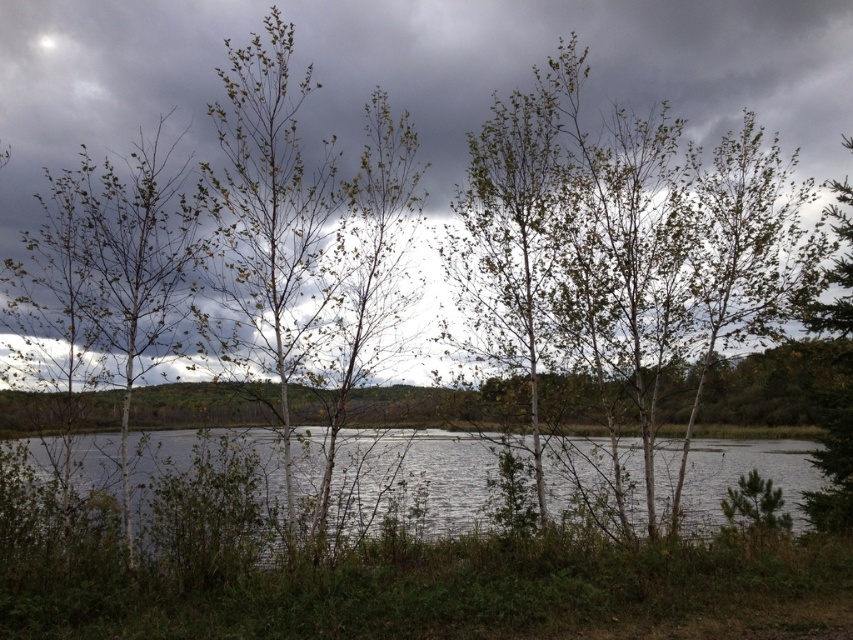
Does gray cloudy sky at upper center have a lesser height compared to clear water at center?

In fact, gray cloudy sky at upper center may be taller than clear water at center.

Can you confirm if gray cloudy sky at upper center is wider than clear water at center?

No.

Find the location of a particular element. Image resolution: width=853 pixels, height=640 pixels. gray cloudy sky at upper center is located at coordinates (413, 72).

You are a GUI agent. You are given a task and a screenshot of the screen. Output one action in this format:
    pyautogui.click(x=<x>, y=<y>)
    Task: Click on the gray cloudy sky at upper center
    
    Given the screenshot: What is the action you would take?
    pyautogui.click(x=413, y=72)